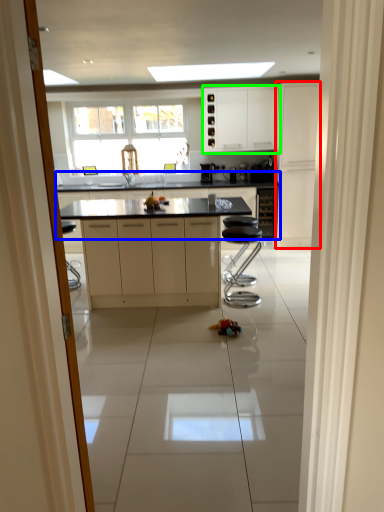
Question: Which object is the closest to the cabinetry (highlighted by a red box)? Choose among these: countertop (highlighted by a blue box) or cabinetry (highlighted by a green box).

Choices:
 (A) countertop
 (B) cabinetry

Answer: (B)